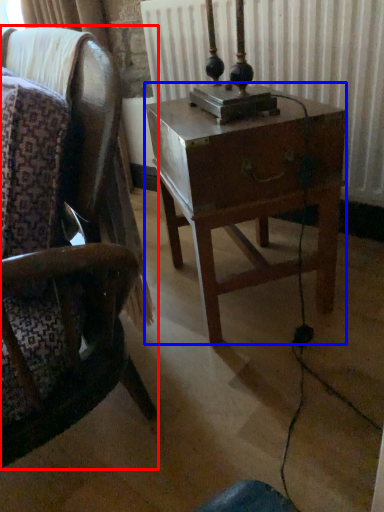
Question: Which object appears farthest to the camera in this image, chair (highlighted by a red box) or nightstand (highlighted by a blue box)?

Choices:
 (A) chair
 (B) nightstand

Answer: (B)